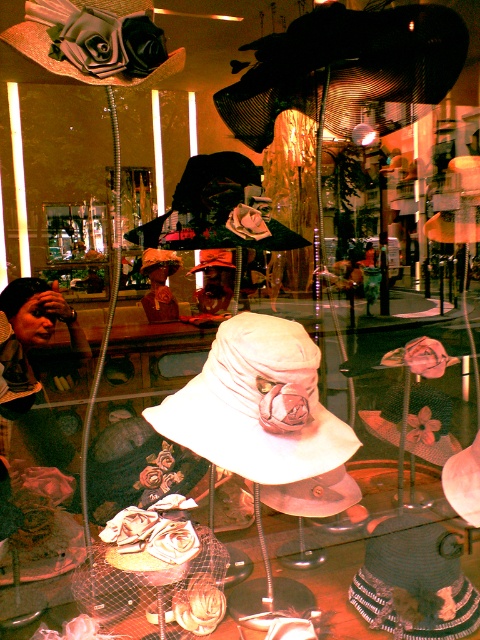
Question: Is white fabric hat at center wider than matte black baseball hat at upper left?

Choices:
 (A) yes
 (B) no

Answer: (A)

Question: Is white matte baseball hat at center below matte black baseball hat at upper left?

Choices:
 (A) yes
 (B) no

Answer: (A)

Question: Which object is positioned closest to the white matte baseball hat at center?

Choices:
 (A) matte black baseball hat at upper left
 (B) white fabric hat at center

Answer: (A)

Question: Which point appears closest to the camera in this image?

Choices:
 (A) (256, 188)
 (B) (222, 452)

Answer: (B)

Question: Is white fabric hat at center closer to the viewer compared to white matte baseball hat at center?

Choices:
 (A) no
 (B) yes

Answer: (B)

Question: Estimate the real-world distances between objects in this image. Which object is farther from the white matte baseball hat at center?

Choices:
 (A) white fabric hat at center
 (B) matte black baseball hat at upper left

Answer: (A)